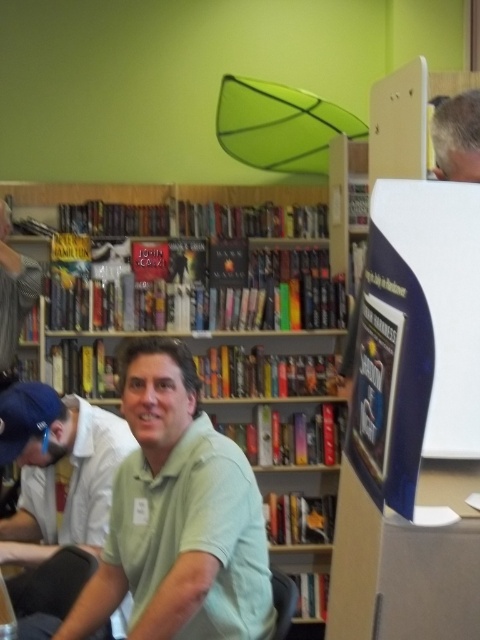
Question: Among these objects, which one is farthest from the camera?

Choices:
 (A) wooden bookshelf at center
 (B) light green polo shirt at center
 (C) gray hair at upper right

Answer: (A)

Question: Can you confirm if green matte shirt at center is positioned below wooden bookshelf at center?

Choices:
 (A) yes
 (B) no

Answer: (A)

Question: Is light green polo shirt at center below gray hair at upper right?

Choices:
 (A) no
 (B) yes

Answer: (B)

Question: Estimate the real-world distances between objects in this image. Which object is farther from the light green polo shirt at center?

Choices:
 (A) green matte shirt at center
 (B) wooden bookshelf at center

Answer: (B)

Question: Which point appears closest to the camera in this image?

Choices:
 (A) (12, 550)
 (B) (444, 154)
 (C) (168, 556)
 (D) (19, 189)

Answer: (B)

Question: Does light green polo shirt at center have a lesser width compared to wooden bookshelf at center?

Choices:
 (A) yes
 (B) no

Answer: (A)